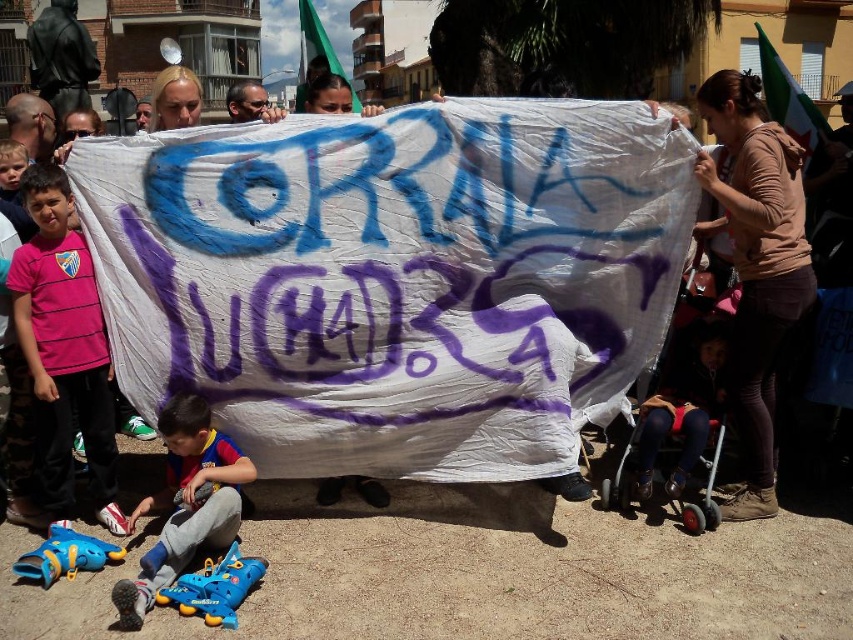
You are a photographer trying to capture the protest scene. You notice the pink fabric shirt at left and the blue rubber roller skates at lower left in your frame. Which object should you zoom in on to avoid blurring due to their size differences?

The pink fabric shirt at left is thinner than the blue rubber roller skates at lower left, so you should zoom in on the blue rubber roller skates at lower left to avoid blurring since they are larger.

You are a photographer trying to capture the banner in the center. You notice a pink fabric shirt at left and blue rubber roller skates at lower left. Which object should you focus on to ensure the banner is in the background?

The pink fabric shirt at left is above the blue rubber roller skates at lower left, so focusing on the pink fabric shirt at left will place the banner in the background.

You are a photographer trying to capture the protest scene. You notice two specific points in the image at coordinates point (x=25, y=324) and point (x=666, y=492). Which point should you focus on to ensure the subject is closer to the camera?

Point (x=25, y=324) is in front of point (x=666, y=492), so focusing on point (x=25, y=324) will ensure the subject is closer to the camera.